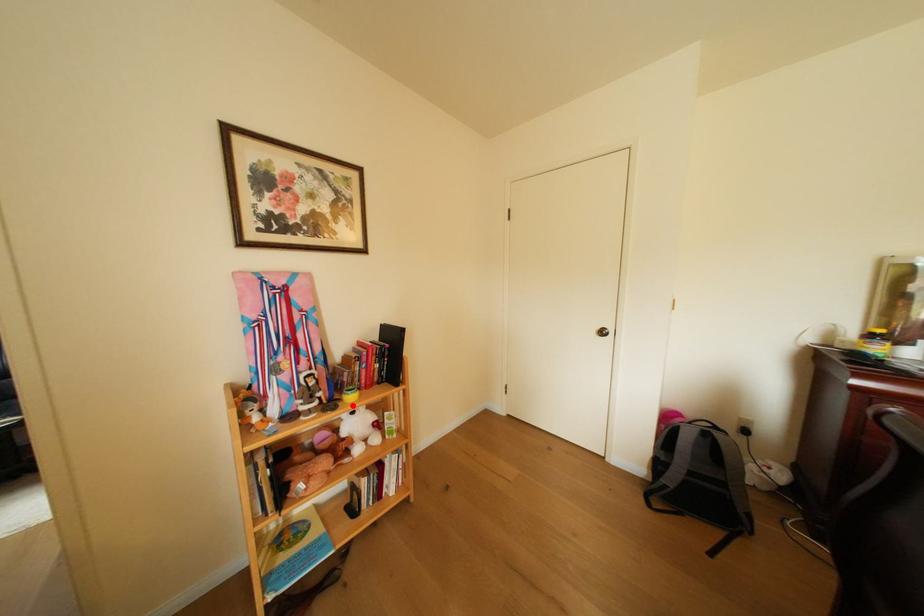
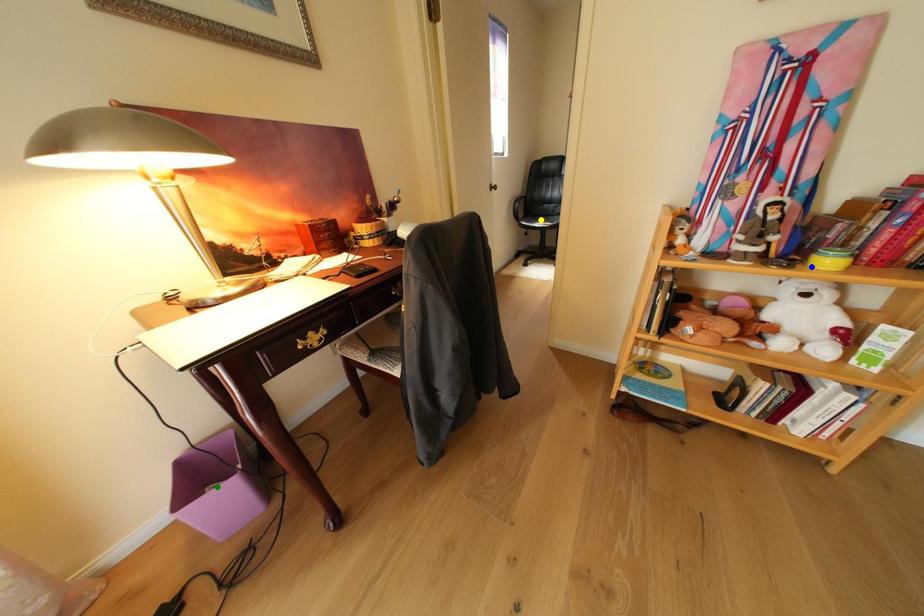
Question: I am providing you with two images of the same scene from different viewpoints. A red point is marked on the first image. You are given multiple points on the second image. Which point in image 2 represents the same 3d spot as the red point in image 1?

Choices:
 (A) green point
 (B) blue point
 (C) yellow point

Answer: (B)